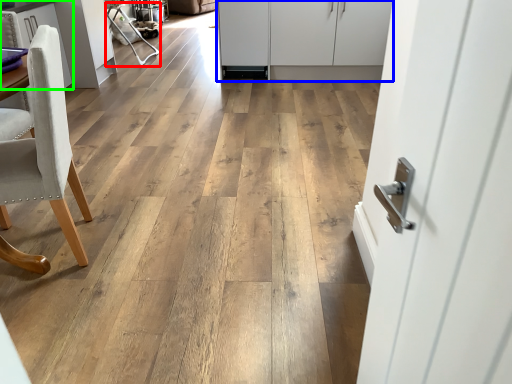
Question: Which object is positioned farthest from armchair (highlighted by a red box)? Select from cabinetry (highlighted by a blue box) and cabinetry (highlighted by a green box).

Choices:
 (A) cabinetry
 (B) cabinetry

Answer: (A)